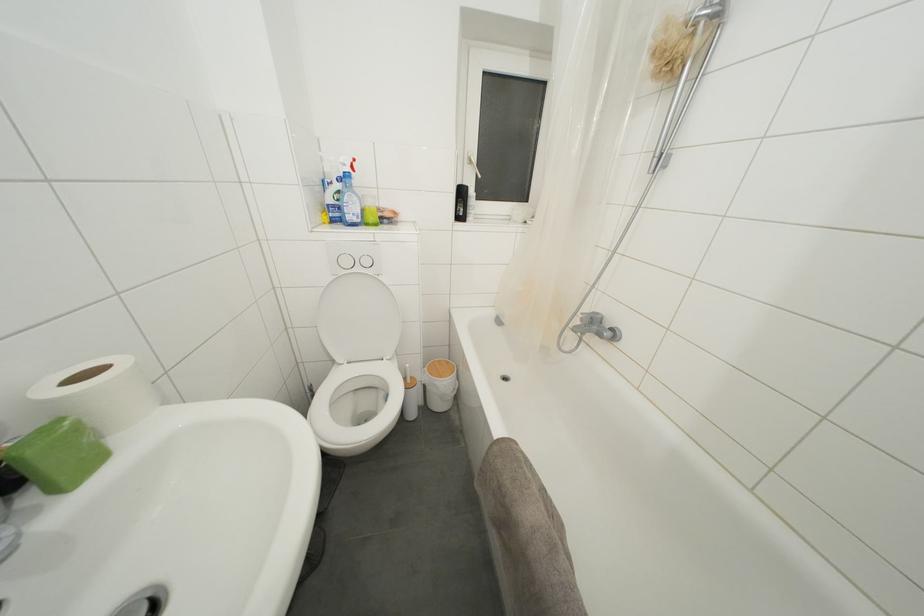
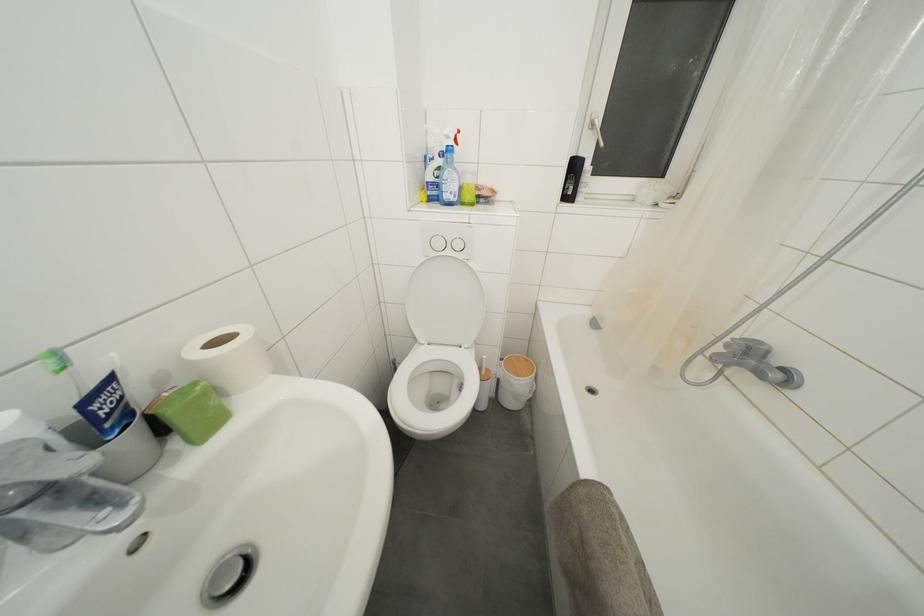
What movement of the cameraman would produce the second image?

The movement direction of the cameraman is left, forward.